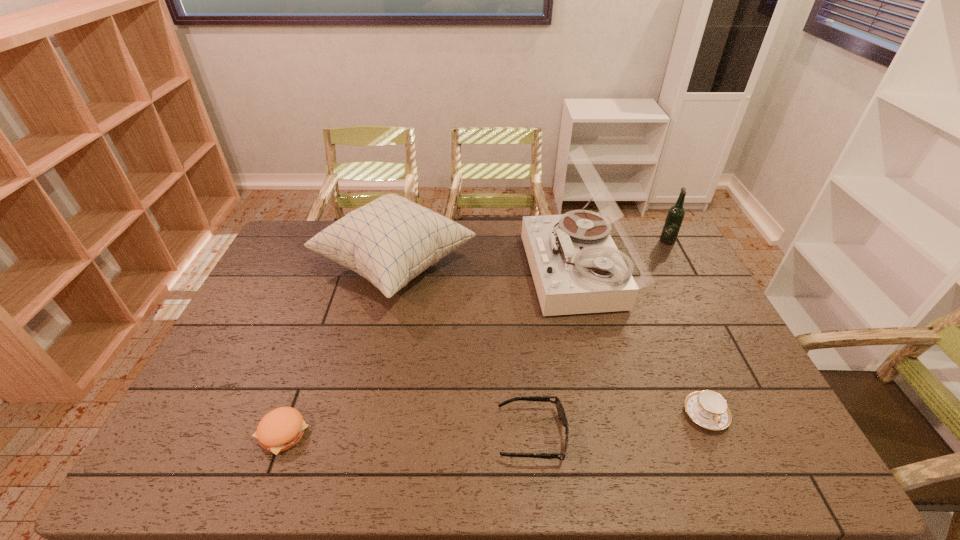
Identify the location of teacup that is at the right edge. (709, 409).

I want to click on object situated at the far right corner, so click(675, 216).

I want to click on vacant space at the far edge, so click(616, 245).

The image size is (960, 540). I want to click on vacant point at the near edge, so click(361, 464).

In the image, there is a desktop. Identify the location of vacant space at the left edge. (300, 279).

This screenshot has width=960, height=540. Find the location of `free space at the right edge`. free space at the right edge is located at coordinates (728, 440).

In the image, there is a desktop. Where is `vacant space at the far left corner`? The width and height of the screenshot is (960, 540). vacant space at the far left corner is located at coordinates (311, 238).

Find the location of a particular element. free space at the near left corner is located at coordinates (179, 456).

I want to click on vacant space at the near right corner of the desktop, so click(749, 448).

Identify the location of vacant area that lies between the teacup and the patty. This screenshot has height=540, width=960. (493, 424).